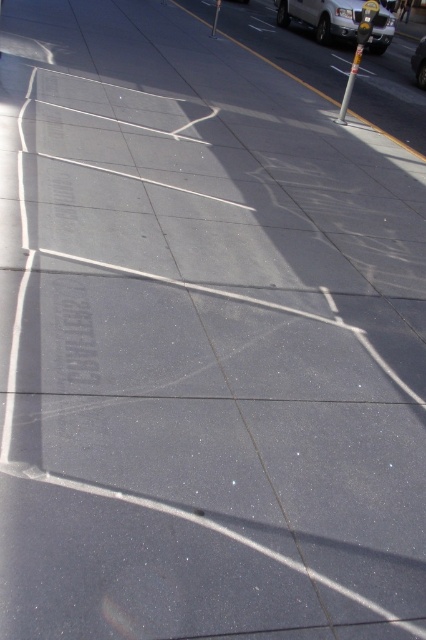
Who is taller, white glossy van at upper right or metallic silver car at upper right?

Standing taller between the two is metallic silver car at upper right.

The width and height of the screenshot is (426, 640). What do you see at coordinates (322, 17) in the screenshot?
I see `white glossy van at upper right` at bounding box center [322, 17].

Does point (333, 4) come behind point (423, 88)?

Yes, point (333, 4) is farther from viewer.

This screenshot has width=426, height=640. Identify the location of white glossy van at upper right. (322, 17).